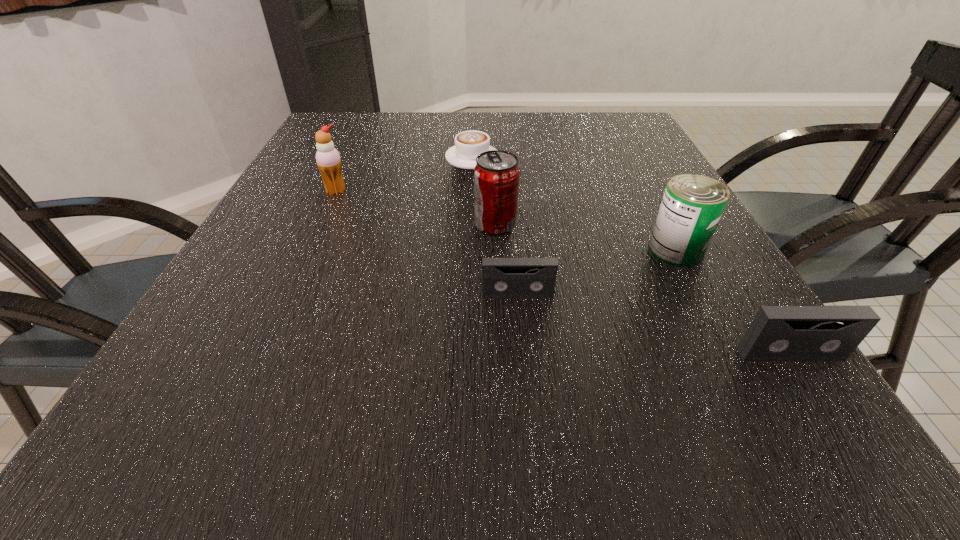
Find the location of a particular element. Image resolution: width=960 pixels, height=540 pixels. vacant space that is in between the leftmost object and the fifth tallest object is located at coordinates (427, 243).

Where is `free space between the pop soda and the fifth nearest object`? Image resolution: width=960 pixels, height=540 pixels. free space between the pop soda and the fifth nearest object is located at coordinates (416, 208).

Find the location of a particular element. Image resolution: width=960 pixels, height=540 pixels. free space between the pop soda and the taller videotape is located at coordinates (642, 289).

Locate an element on the screen. empty space that is in between the can and the farthest object is located at coordinates (574, 204).

The width and height of the screenshot is (960, 540). What are the coordinates of `unoccupied area between the farthest object and the fourth tallest object` in the screenshot? It's located at (631, 256).

This screenshot has height=540, width=960. What are the coordinates of `vacant region between the nearest object and the farther videotape` in the screenshot? It's located at (654, 325).

I want to click on vacant space that is in between the taller videotape and the can, so click(x=732, y=302).

Where is `free spot between the cappuccino and the right videotape`? free spot between the cappuccino and the right videotape is located at coordinates (631, 256).

At what (x,y) coordinates should I click in order to perform the action: click on free space between the can and the pop soda. Please return your answer as a coordinate pair (x, y). Looking at the image, I should click on (586, 237).

Where is `object that stands as the fourth closest to the taller videotape`? This screenshot has width=960, height=540. object that stands as the fourth closest to the taller videotape is located at coordinates (469, 144).